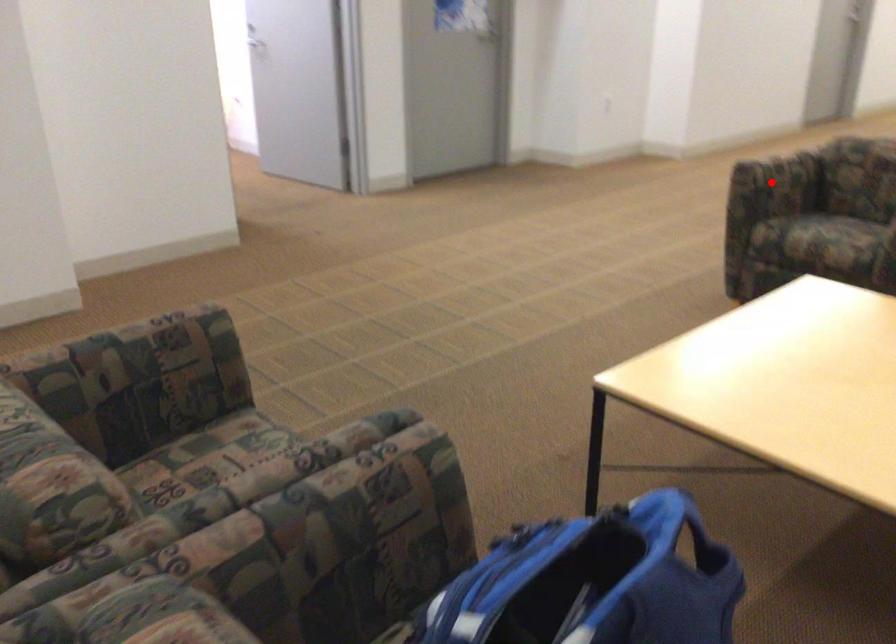
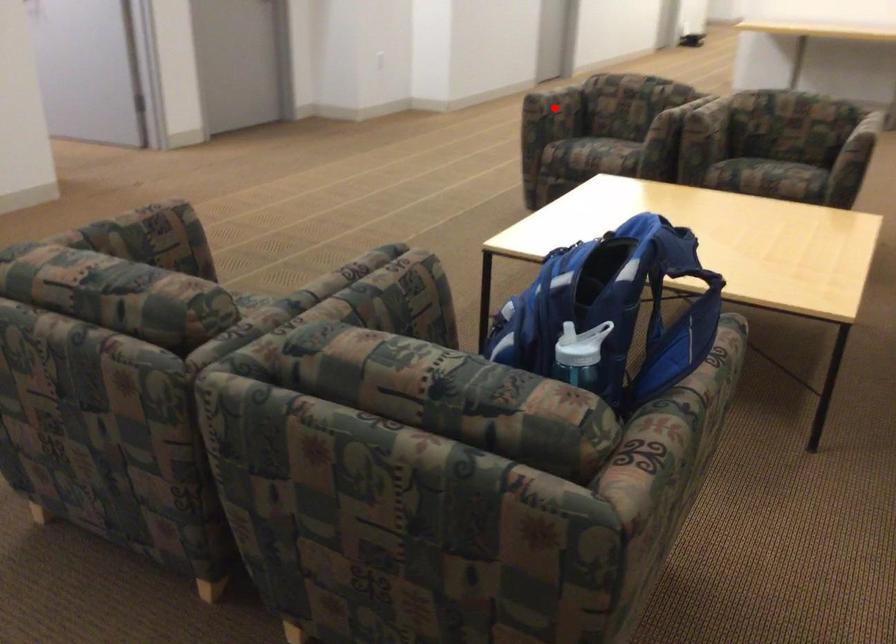
I am providing you with two images of the same scene from different viewpoints. A red point is marked on the first image and another point is marked on the second image. Is the marked point in image1 the same physical position as the marked point in image2?

Yes